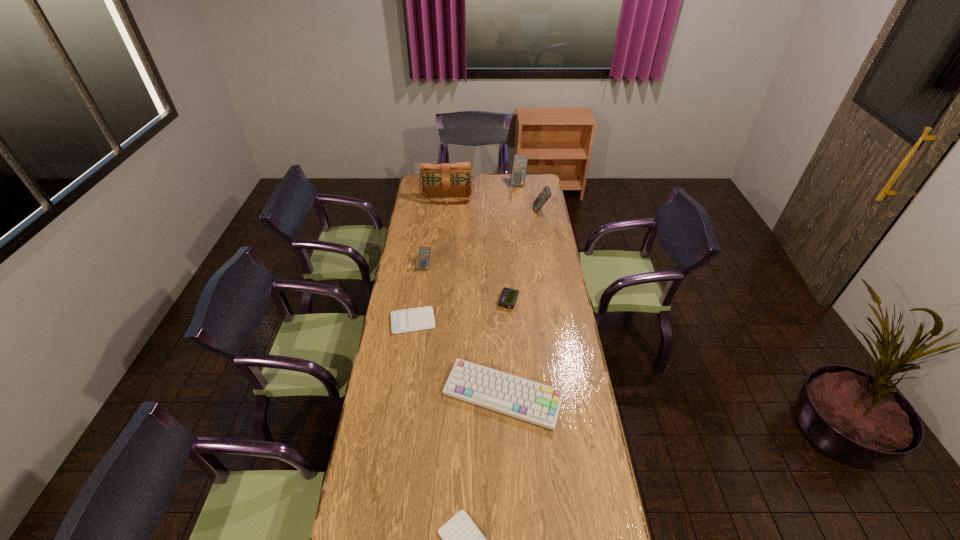
This screenshot has height=540, width=960. In order to click on the tallest object in this screenshot , I will do `click(438, 180)`.

Where is `shoulder bag`? Image resolution: width=960 pixels, height=540 pixels. shoulder bag is located at coordinates (438, 180).

What are the coordinates of `the second blue calculator from right to left` in the screenshot? It's located at (519, 165).

You are a GUI agent. You are given a task and a screenshot of the screen. Output one action in this format:
    pyautogui.click(x=<x>, y=<y>)
    Task: Click on the fourth calculator from left to right
    The image size is (960, 540).
    Given the screenshot: What is the action you would take?
    pyautogui.click(x=519, y=165)

I want to click on the third tallest object, so click(545, 194).

Where is `the rightmost blue calculator`? the rightmost blue calculator is located at coordinates (545, 194).

This screenshot has height=540, width=960. In order to click on the smallest blue calculator in this screenshot , I will do `click(424, 252)`.

The height and width of the screenshot is (540, 960). In order to click on the third farthest calculator in this screenshot , I will do `click(424, 252)`.

What are the coordinates of `the fifth tallest object` in the screenshot? It's located at (514, 396).

Identify the location of white computer keyboard. (514, 396).